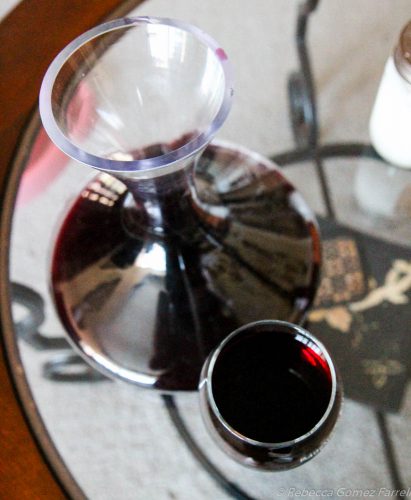
You are a GUI agent. You are given a task and a screenshot of the screen. Output one action in this format:
    pyautogui.click(x=<x>, y=<y>)
    Task: Click on the goblet
    
    Given the screenshot: What is the action you would take?
    pyautogui.click(x=281, y=402)